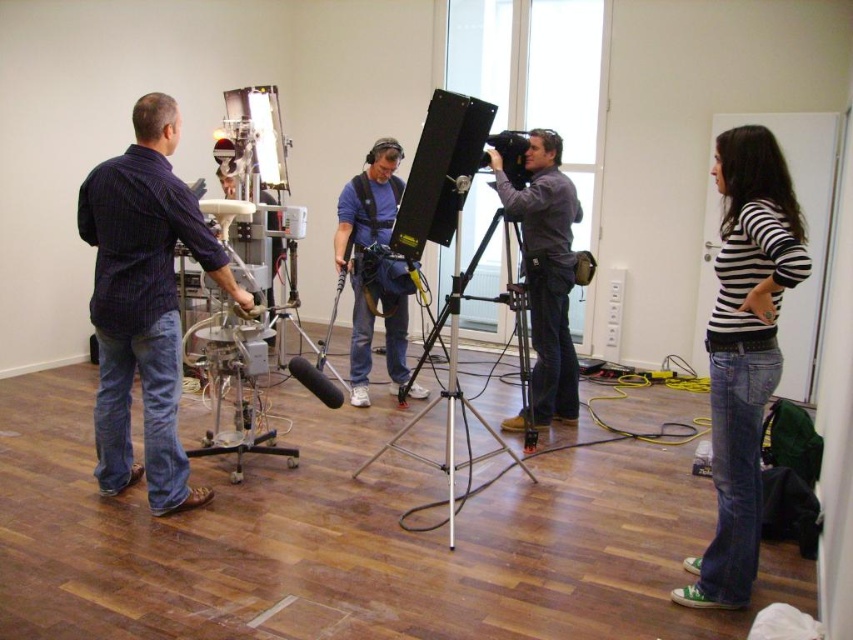
Question: Which of the following is the closest to the observer?

Choices:
 (A) black plastic video camera at center
 (B) white metallic tripod at center

Answer: (B)

Question: Does blue striped shirt at left have a greater width compared to black plastic video camera at center?

Choices:
 (A) yes
 (B) no

Answer: (A)

Question: Which is farther from the striped cotton shirt at right?

Choices:
 (A) matte gray camera at center
 (B) matte blue shirt at center

Answer: (B)

Question: Does matte blue shirt at center appear on the left side of white metallic tripod at center?

Choices:
 (A) yes
 (B) no

Answer: (A)

Question: Is blue striped shirt at left positioned behind striped cotton shirt at right?

Choices:
 (A) yes
 (B) no

Answer: (A)

Question: Which point is farther to the camera?

Choices:
 (A) (x=498, y=442)
 (B) (x=126, y=202)

Answer: (A)